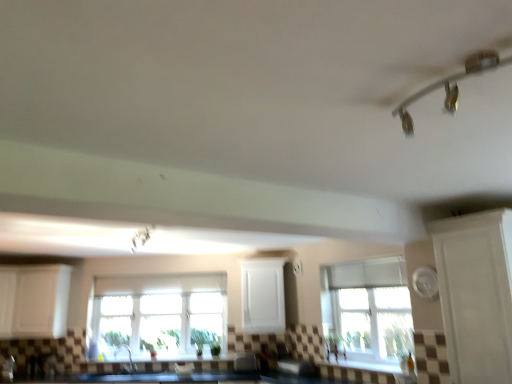
Question: Based on their sizes in the image, would you say metallic white light fixture at upper center, acting as the 1th light fixture starting from the back, is bigger or smaller than matte gray toaster at lower center?

Choices:
 (A) small
 (B) big

Answer: (B)

Question: From the image's perspective, is metallic white light fixture at upper center, which ranks as the 2th light fixture in right-to-left order, above or below matte gray toaster at lower center?

Choices:
 (A) above
 (B) below

Answer: (A)

Question: Which is farther from the white matte cabinet at left, marked as the 2th cabinetry in a left-to-right arrangement?

Choices:
 (A) white metallic track lighting at upper right, the 2th light fixture from the left
 (B) clear glass window at center, which is the 2th window from right to left
 (C) matte gray toaster at lower center
 (D) silver metallic faucet at lower left
 (E) metallic white light fixture at upper center, acting as the 1th light fixture starting from the back

Answer: (A)

Question: Estimate the real-world distances between objects in this image. Which object is closer to the white matte cabinet at center, which is the first cabinetry in right-to-left order?

Choices:
 (A) white matte cabinet at left, which is the 2th cabinetry in right-to-left order
 (B) white glossy cabinet at right
 (C) white matte cabinet at left, which is the third cabinetry in right-to-left order
 (D) metallic white light fixture at upper center, the second light fixture positioned from the top
 (E) white textured window at center, marked as the 1th window in a right-to-left arrangement

Answer: (E)